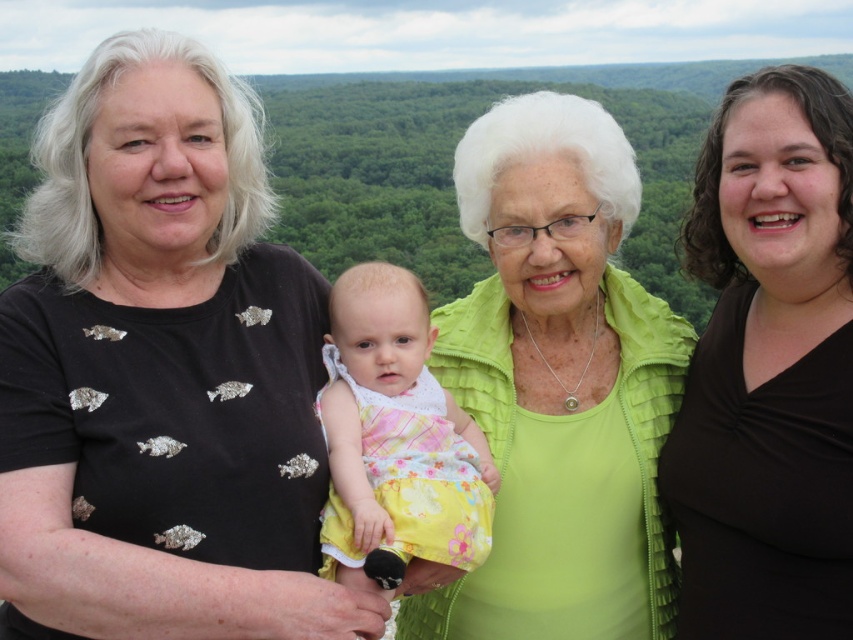
Question: Which object is positioned closest to the green textured jacket at upper center?

Choices:
 (A) lime green textured jacket at center
 (B) black textured shirt at left

Answer: (A)

Question: Among these points, which one is nearest to the camera?

Choices:
 (A) (257, 192)
 (B) (544, 397)
 (C) (785, 636)

Answer: (C)

Question: Is green textured jacket at upper center wider than yellow floral dress at center?

Choices:
 (A) no
 (B) yes

Answer: (B)

Question: Which object is closer to the camera taking this photo?

Choices:
 (A) green textured jacket at upper center
 (B) lime green textured jacket at center
 (C) yellow floral dress at center
 (D) black textured shirt at left

Answer: (D)

Question: Does black textured shirt at left appear on the right side of yellow floral dress at center?

Choices:
 (A) yes
 (B) no

Answer: (B)

Question: Can you confirm if green textured jacket at upper center is positioned to the left of yellow floral dress at center?

Choices:
 (A) yes
 (B) no

Answer: (B)